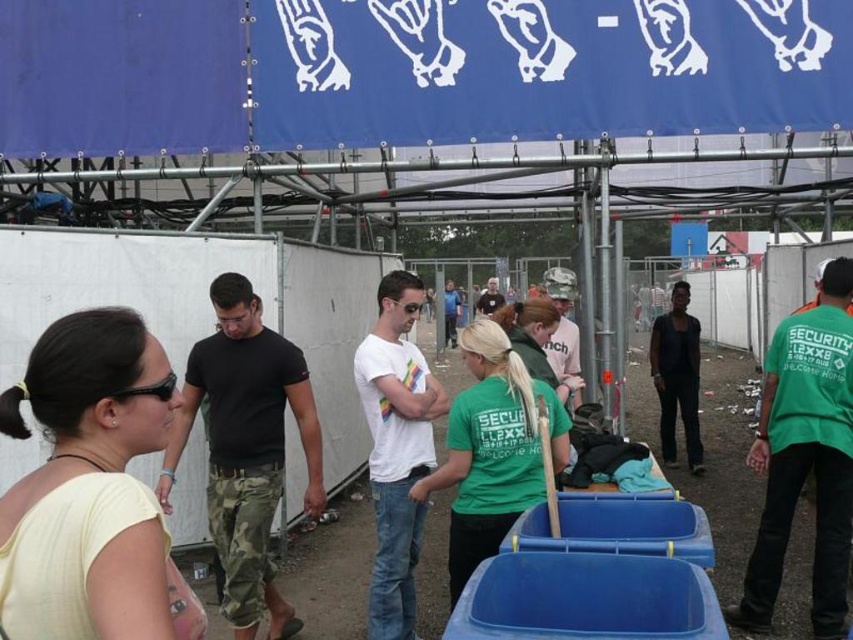
You are standing at the point marked by the coordinates point (x=805, y=456). Looking around, you see a woman in a light yellow top on the left and two men on the right. Which direction should you turn to face the green cotton shirt at center?

The point (x=805, y=456) is marked as the green cotton shirt at center, so you are already facing it. No need to turn.